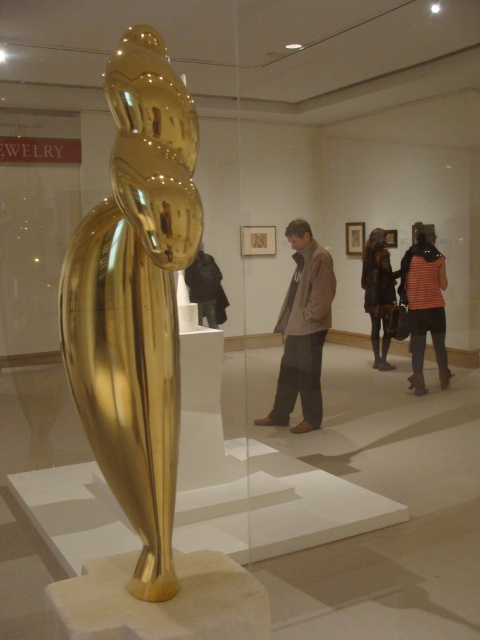
You are an art student who wants to take a photo of the gold polished sculpture at center and the striped fabric at right. Which object should you focus on first if you want to capture both in one frame without moving your camera?

The gold polished sculpture at center has a lesser height compared to striped fabric at right, so you should focus on the gold polished sculpture at center first to ensure both are in frame.

You are a photographer standing at the entrance of the gallery. You want to take a photo of the gold polished sculpture at center without any visitors in the frame. The camera you are using has a maximum focus range of 1.5 meters. Can you capture the sculpture clearly without moving closer?

The gold polished sculpture at center is 1.23 meters away from camera, which is within the camera maximum focus range of 1.5 meters. Therefore, you can capture the sculpture clearly without moving closer.